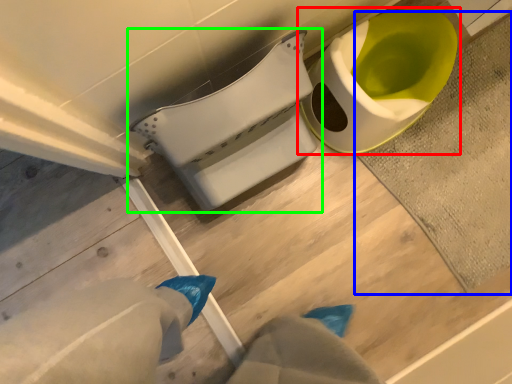
Question: Considering the real-world distances, which object is farthest from toilet (highlighted by a red box)? bath mat (highlighted by a blue box) or toilet (highlighted by a green box)?

Choices:
 (A) bath mat
 (B) toilet

Answer: (B)